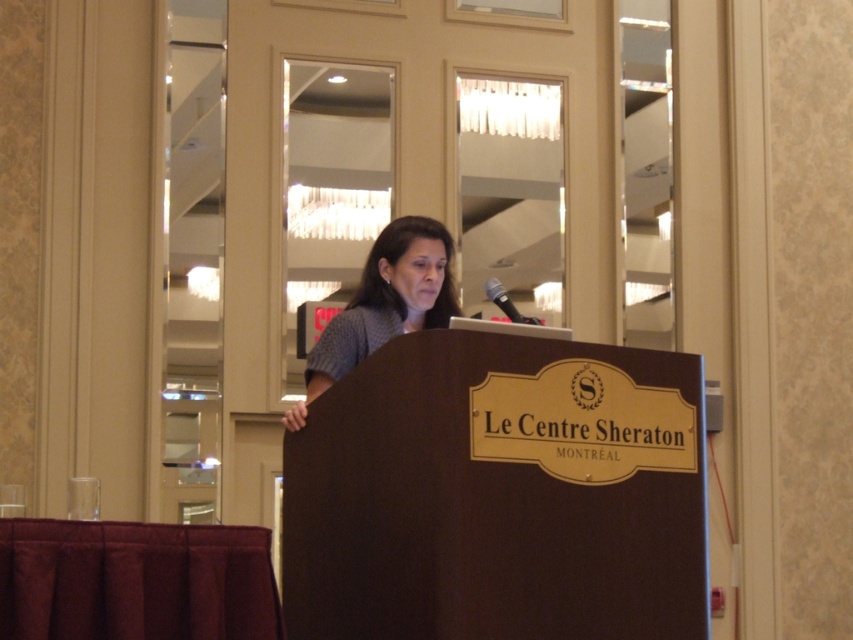
From the picture: You are a photographer setting up for a speech event. You need to ensure that the matte gray blouse at center and the black metallic microphone at center are in focus simultaneously. Given that your camera has a depth of field that can cover objects within 20 inches of each other, will both objects be in focus?

The distance between the matte gray blouse at center and the black metallic microphone at center is 19.97 inches, which is within the 20 inch depth of field range. Therefore, both objects will be in focus.

You are a photographer at the event. You need to take a photo of the speaker while ensuring the microphone is visible in the frame. Given that the black metallic microphone at center is behind the matte gray blouse at center, will the microphone be visible in the photo?

The black metallic microphone at center is behind the matte gray blouse at center, so it may not be fully visible in the photo unless the blouse is moved or the angle is adjusted.